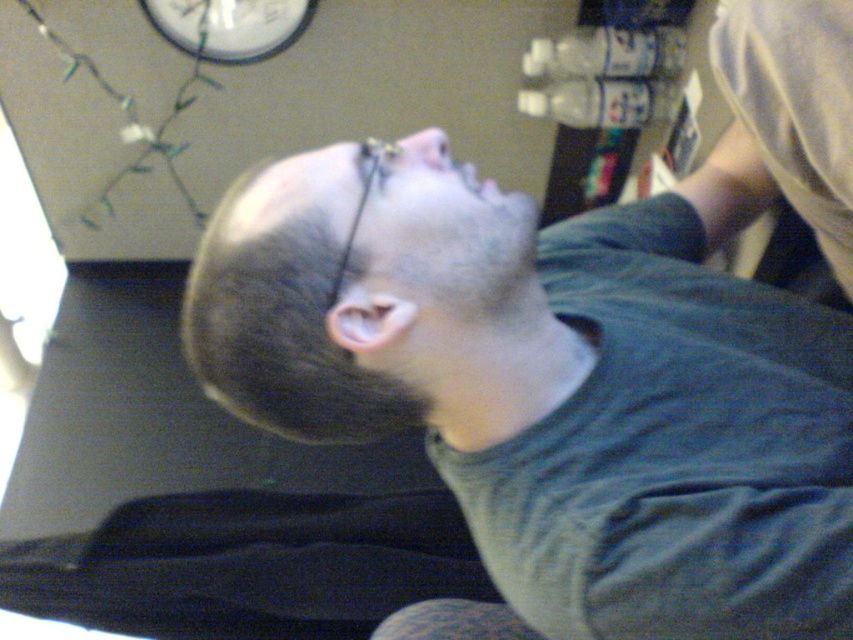
Question: Can you confirm if dark green t-shirt at center is positioned to the right of white plastic clock at upper center?

Choices:
 (A) no
 (B) yes

Answer: (B)

Question: Which point is closer to the camera?

Choices:
 (A) (374, 154)
 (B) (744, 218)
 (C) (154, 22)

Answer: (A)

Question: Based on their relative distances, which object is farther from the dark green t-shirt at center?

Choices:
 (A) dark green fabric at upper center
 (B) white plastic clock at upper center

Answer: (B)

Question: Is dark green fabric at upper center to the right of white plastic clock at upper center from the viewer's perspective?

Choices:
 (A) yes
 (B) no

Answer: (A)

Question: Which is nearer to the white plastic clock at upper center?

Choices:
 (A) dark green fabric at upper center
 (B) dark green t-shirt at center

Answer: (B)

Question: Can you confirm if dark green t-shirt at center is positioned to the left of white plastic clock at upper center?

Choices:
 (A) yes
 (B) no

Answer: (B)